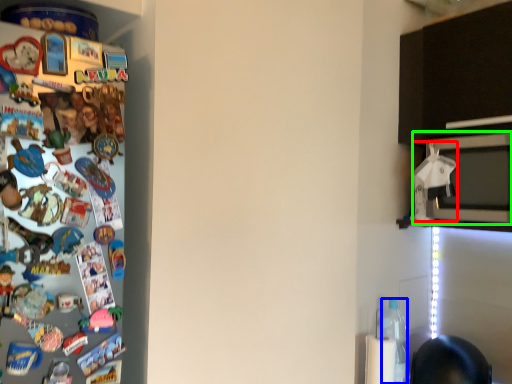
Question: Based on their relative distances, which object is farther from toy (highlighted by a red box)? Choose from bottle (highlighted by a blue box) and microwave oven (highlighted by a green box).

Choices:
 (A) bottle
 (B) microwave oven

Answer: (A)